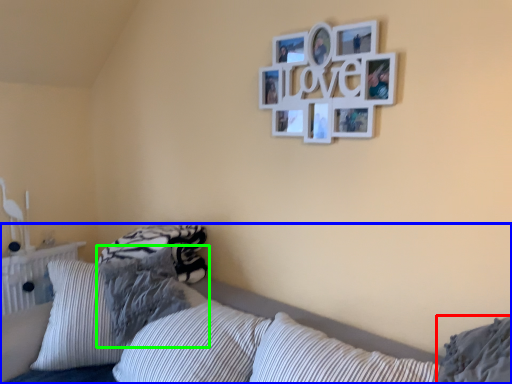
Question: Considering the real-world distances, which object is farthest from pillow (highlighted by a red box)? bed (highlighted by a blue box) or pillow (highlighted by a green box)?

Choices:
 (A) bed
 (B) pillow

Answer: (B)